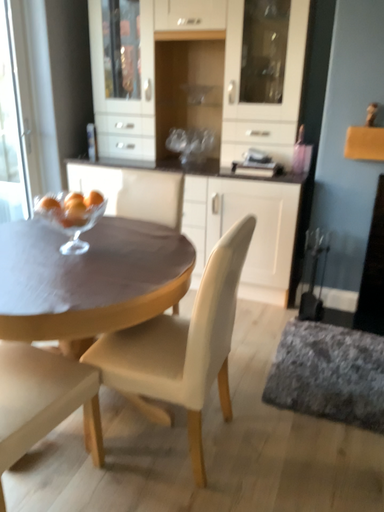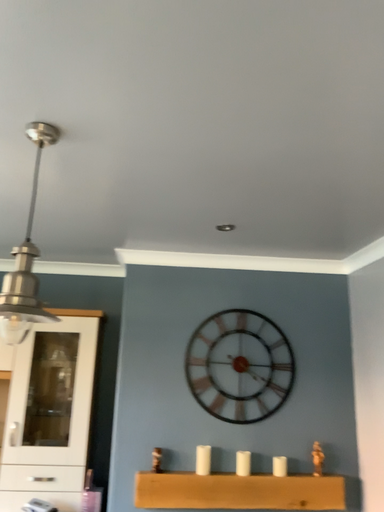
Question: Which way did the camera rotate in the video?

Choices:
 (A) rotated downward
 (B) rotated upward

Answer: (B)